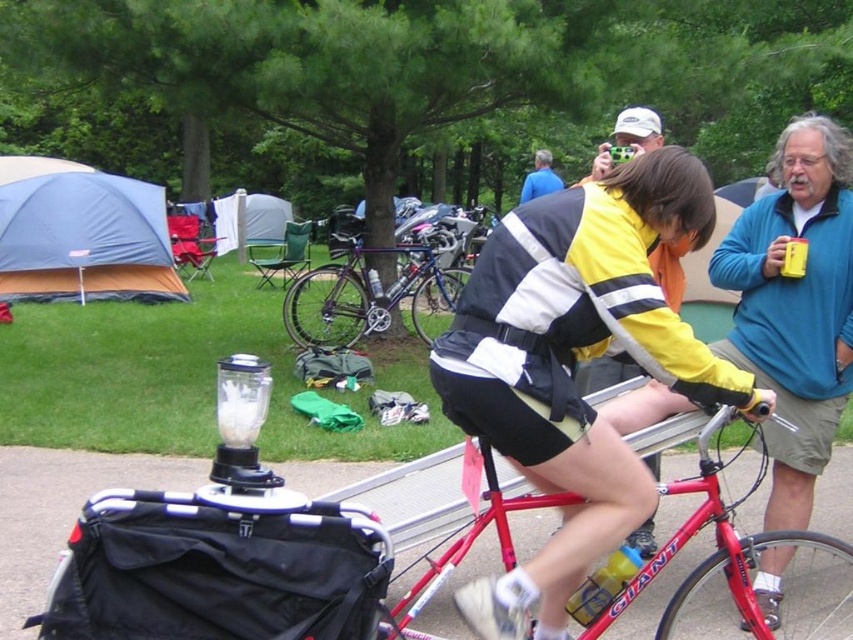
Is yellow matte jacket at center shorter than shiny metallic bicycle at center?

No, yellow matte jacket at center is not shorter than shiny metallic bicycle at center.

Does yellow matte jacket at center appear on the left side of shiny metallic bicycle at center?

Incorrect, yellow matte jacket at center is not on the left side of shiny metallic bicycle at center.

This screenshot has width=853, height=640. I want to click on yellow matte jacket at center, so click(575, 364).

Which is behind, point (45, 164) or point (430, 550)?

Positioned behind is point (45, 164).

Who is taller, blue fabric tent at upper left or red matte bicycle at center?

blue fabric tent at upper left

Find the location of `blue fabric tent at upper left`. blue fabric tent at upper left is located at coordinates (80, 234).

Find the location of a particular element. The width and height of the screenshot is (853, 640). blue fabric tent at upper left is located at coordinates (80, 234).

Between red matte bicycle at center and shiny metallic bicycle at center, which one appears on the right side from the viewer's perspective?

From the viewer's perspective, red matte bicycle at center appears more on the right side.

Identify the location of red matte bicycle at center. (703, 560).

Locate an element on the screen. red matte bicycle at center is located at coordinates (703, 560).